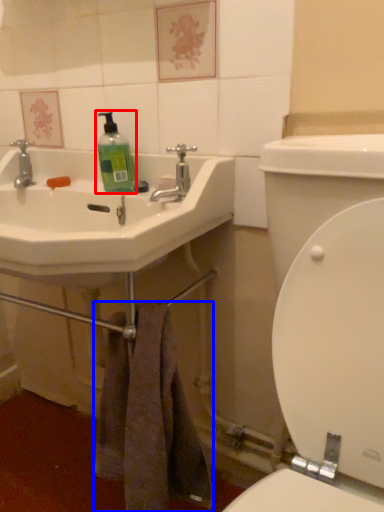
Question: Among these objects, which one is nearest to the camera, cleaning product (highlighted by a red box) or towel/napkin (highlighted by a blue box)?

Choices:
 (A) cleaning product
 (B) towel/napkin

Answer: (B)